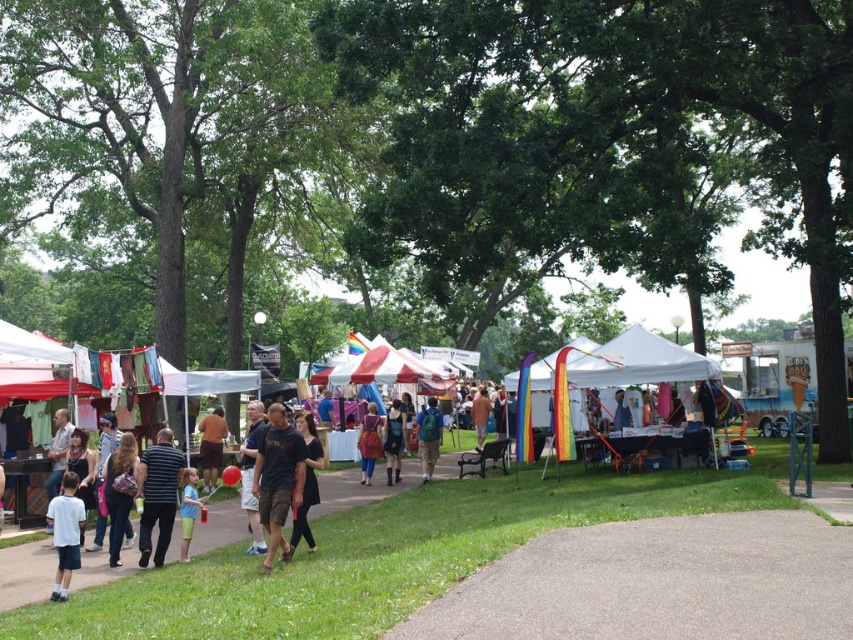
You are standing at the entrance of the park and see the denim jeans at lower left and the brown cotton shirt at center. Which object is positioned higher in the image?

The denim jeans at lower left is above the brown cotton shirt at center in the image.